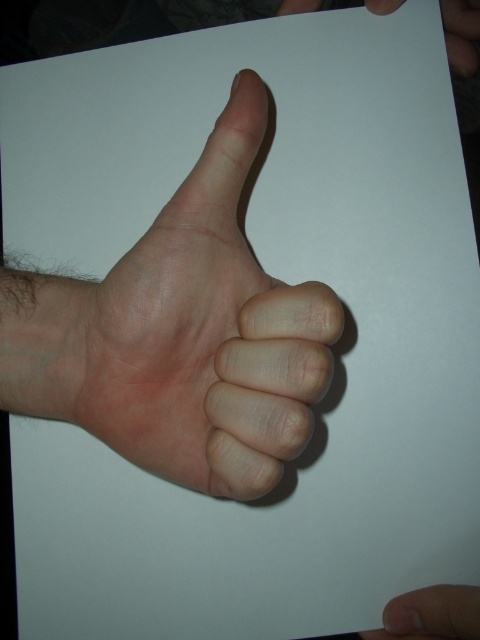
Question: Considering the real-world distances, which object is closest to the smooth skin hand at upper right?

Choices:
 (A) smooth skin at lower right
 (B) pink flesh-colored hand at center

Answer: (B)

Question: Which point is closer to the camera?

Choices:
 (A) (311, 369)
 (B) (403, 625)

Answer: (A)

Question: Which point is farther from the camera taking this photo?

Choices:
 (A) (475, 68)
 (B) (384, 611)
 (C) (263, 280)

Answer: (A)

Question: Is smooth skin at lower right thinner than smooth skin hand at upper right?

Choices:
 (A) yes
 (B) no

Answer: (A)

Question: Does smooth skin at lower right appear on the left side of smooth skin hand at upper right?

Choices:
 (A) no
 (B) yes

Answer: (A)

Question: Is pink flesh-colored hand at center to the left of smooth skin hand at upper right from the viewer's perspective?

Choices:
 (A) no
 (B) yes

Answer: (B)